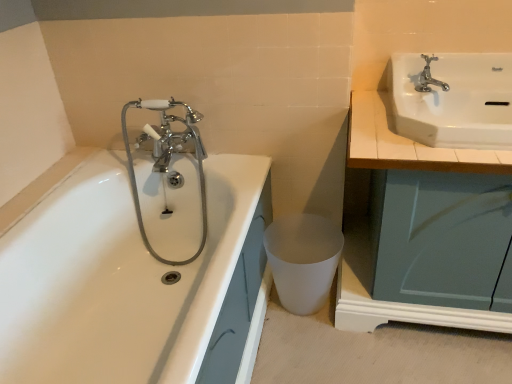
Question: Should I look upward or downward to see chrome metallic faucet at upper right?

Choices:
 (A) up
 (B) down

Answer: (A)

Question: Considering the relative sizes of chrome/metallic faucet at left and white glossy bathtub at left in the image provided, is chrome/metallic faucet at left smaller than white glossy bathtub at left?

Choices:
 (A) yes
 (B) no

Answer: (A)

Question: Would you consider chrome/metallic faucet at left to be distant from white glossy bathtub at left?

Choices:
 (A) yes
 (B) no

Answer: (B)

Question: Is chrome/metallic faucet at left thinner than white glossy bathtub at left?

Choices:
 (A) yes
 (B) no

Answer: (A)

Question: Is chrome/metallic faucet at left positioned before white glossy bathtub at left?

Choices:
 (A) yes
 (B) no

Answer: (B)

Question: From a real-world perspective, is chrome/metallic faucet at left positioned over white glossy bathtub at left based on gravity?

Choices:
 (A) yes
 (B) no

Answer: (A)

Question: From the image's perspective, is chrome/metallic faucet at left beneath white glossy bathtub at left?

Choices:
 (A) yes
 (B) no

Answer: (B)

Question: Is chrome metallic faucet at upper right thinner than white wood countertop at upper right?

Choices:
 (A) no
 (B) yes

Answer: (B)

Question: Is chrome metallic faucet at upper right far away from white wood countertop at upper right?

Choices:
 (A) no
 (B) yes

Answer: (A)

Question: From the image's perspective, is chrome metallic faucet at upper right below white wood countertop at upper right?

Choices:
 (A) yes
 (B) no

Answer: (B)

Question: Considering the relative sizes of chrome metallic faucet at upper right and white wood countertop at upper right in the image provided, is chrome metallic faucet at upper right shorter than white wood countertop at upper right?

Choices:
 (A) no
 (B) yes

Answer: (B)

Question: Considering the relative sizes of chrome metallic faucet at upper right and white wood countertop at upper right in the image provided, is chrome metallic faucet at upper right wider than white wood countertop at upper right?

Choices:
 (A) yes
 (B) no

Answer: (B)

Question: From a real-world perspective, is chrome metallic faucet at upper right beneath white wood countertop at upper right?

Choices:
 (A) no
 (B) yes

Answer: (A)

Question: From a real-world perspective, is white glossy sink at upper right on white matte plastic at lower center?

Choices:
 (A) yes
 (B) no

Answer: (A)